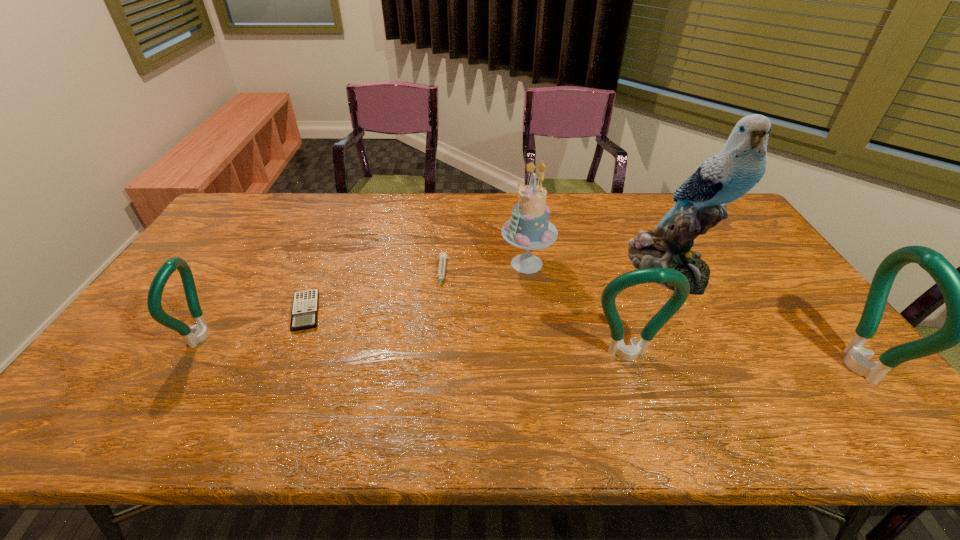
Locate an element on the screen. Image resolution: width=960 pixels, height=540 pixels. object that is the fifth closest one to the rightmost object is located at coordinates (305, 306).

This screenshot has height=540, width=960. What are the coordinates of `bottle opener that stands as the second closest to the fourth object from right to left` in the screenshot? It's located at (959, 291).

Identify which bottle opener is located as the nearest to the third object from left to right. Please provide its 2D coordinates. Your answer should be formatted as a tuple, i.e. [(x, y)], where the tuple contains the x and y coordinates of a point satisfying the conditions above.

[(630, 352)]

Find the location of a particular element. The width and height of the screenshot is (960, 540). blank space that satisfies the following two spatial constraints: 1. with a ladder on the side of the cake; 2. on the front side of the sixth object from right to left is located at coordinates (533, 312).